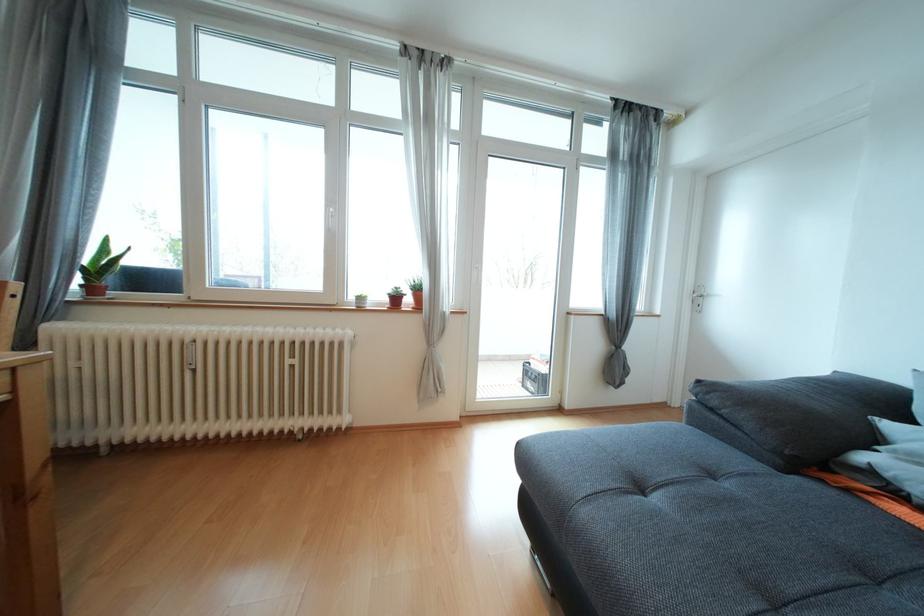
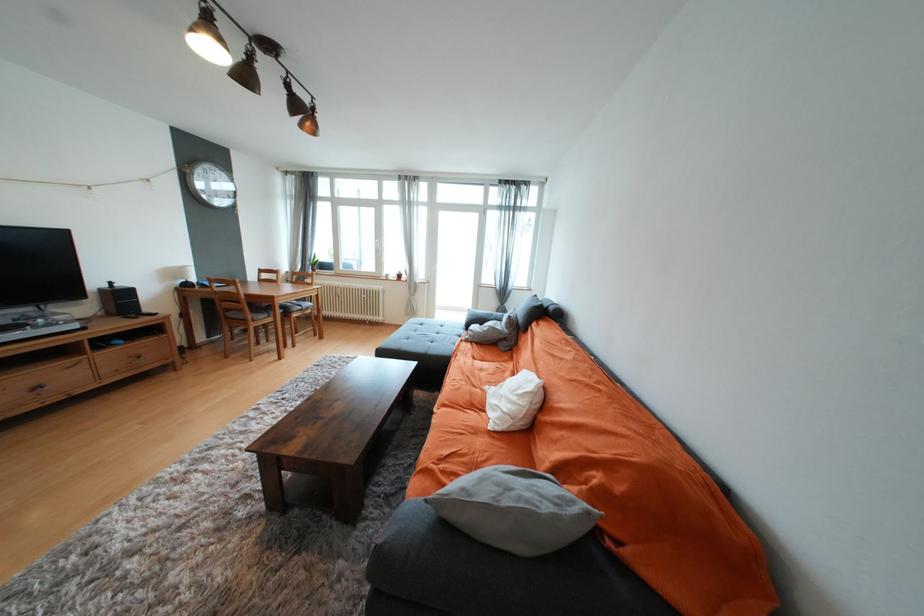
Where in the second image is the point corresponding to point 300,349 from the first image?

(371, 293)